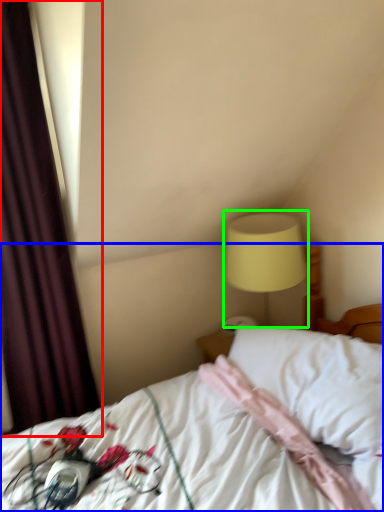
Question: Which object is the farthest from curtain (highlighted by a red box)? Choose among these: bed (highlighted by a blue box) or bedside lamp (highlighted by a green box).

Choices:
 (A) bed
 (B) bedside lamp

Answer: (B)